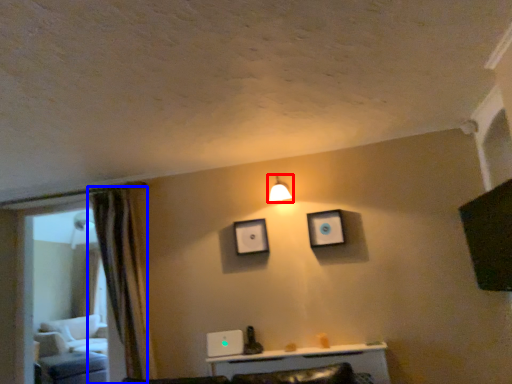
Question: Among these objects, which one is nearest to the camera, light fixture (highlighted by a red box) or curtain (highlighted by a blue box)?

Choices:
 (A) light fixture
 (B) curtain

Answer: (B)